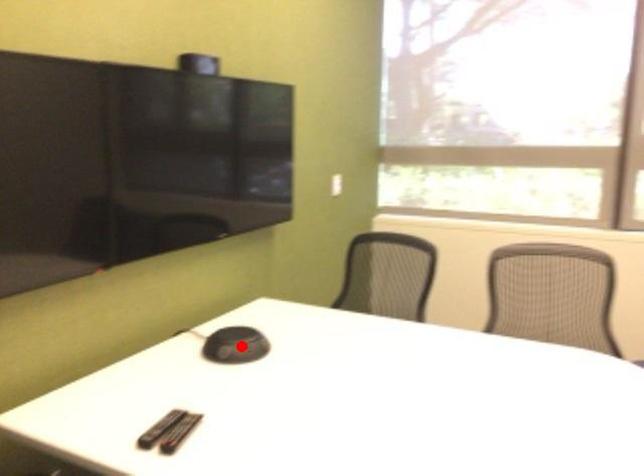
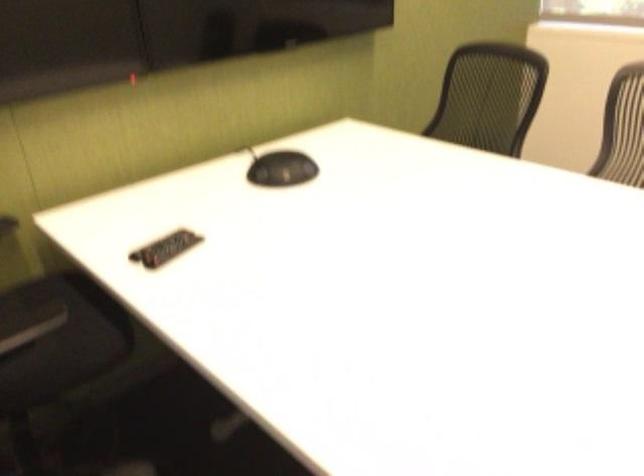
Locate, in the second image, the point that corresponds to the highlighted location in the first image.

(281, 169)